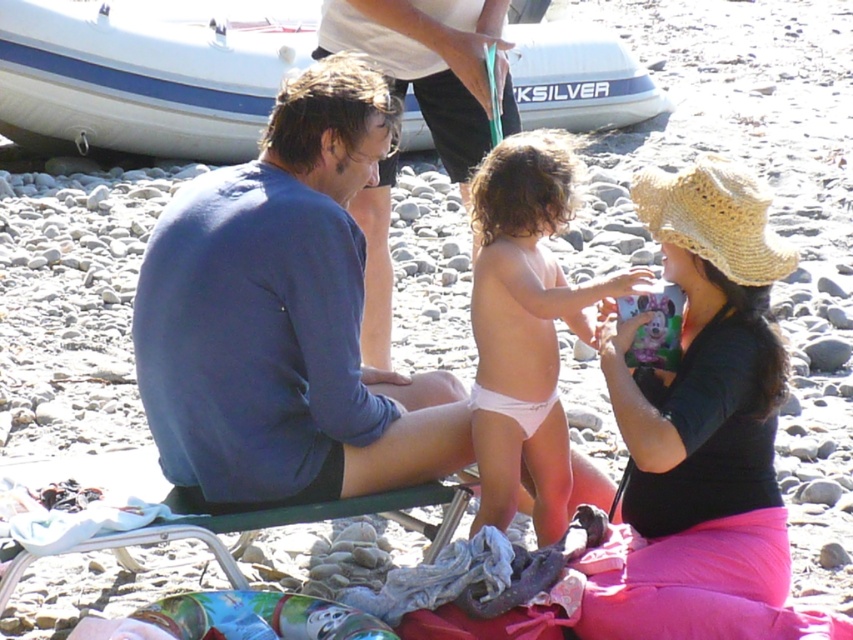
Question: Which is nearer to the pink fabric diaper at center?

Choices:
 (A) white fabric diaper at center
 (B) straw hat at center
 (C) white rubber boat at upper center

Answer: (A)

Question: Observing the image, what is the correct spatial positioning of white rubber boat at upper center in reference to pink fabric diaper at center?

Choices:
 (A) below
 (B) above

Answer: (B)

Question: Considering the real-world distances, which object is farthest from the blue cotton shirt at center?

Choices:
 (A) white fabric diaper at center
 (B) straw hat at upper right
 (C) white rubber boat at upper center

Answer: (C)

Question: Based on their relative distances, which object is farther from the pink fabric diaper at center?

Choices:
 (A) white rubber boat at upper center
 (B) straw hat at upper right
 (C) blue cotton shirt at center
 (D) white fabric diaper at center

Answer: (A)

Question: Is white rubber boat at upper center to the right of blue cotton shirt at center from the viewer's perspective?

Choices:
 (A) yes
 (B) no

Answer: (B)

Question: Is the position of blue cotton shirt at center more distant than that of straw hat at upper right?

Choices:
 (A) no
 (B) yes

Answer: (B)